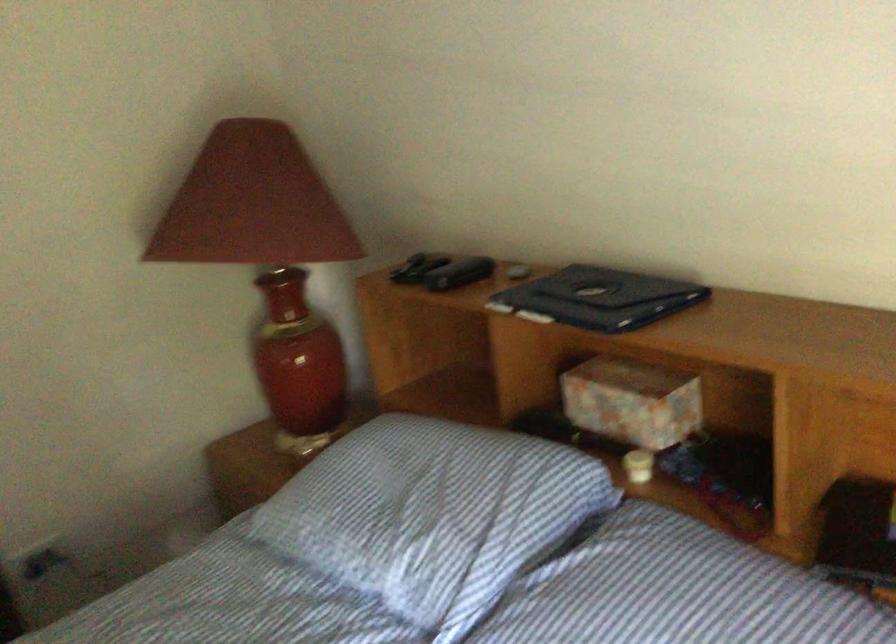
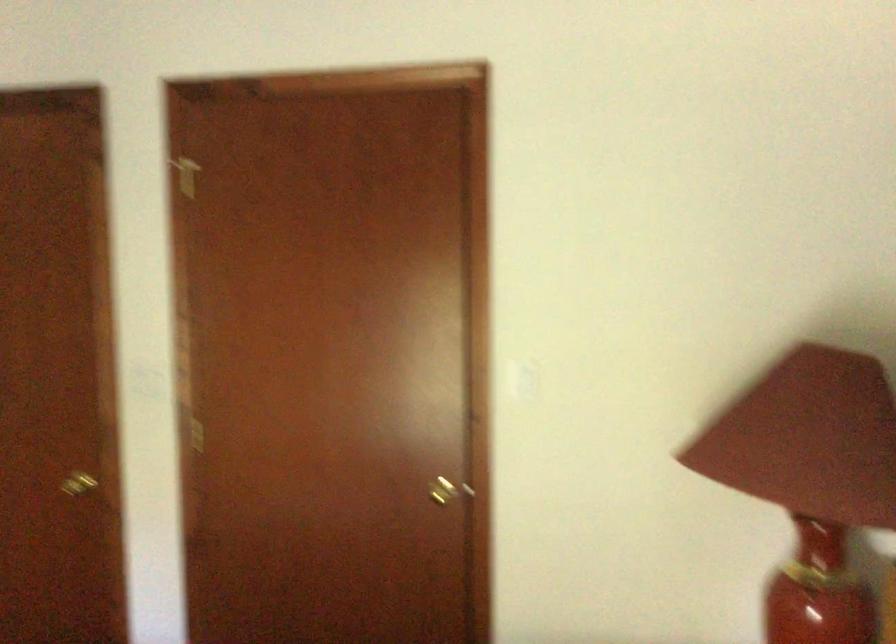
Question: Based on the continuous images, in which direction is the camera rotating? Reply with the corresponding letter.

Choices:
 (A) Left
 (B) Right
 (C) Up
 (D) Down

Answer: (A)